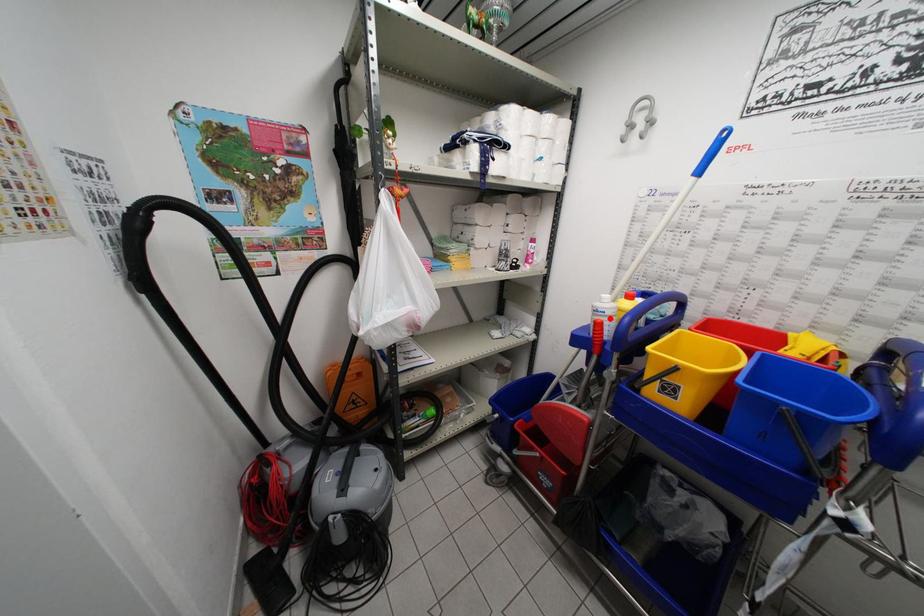
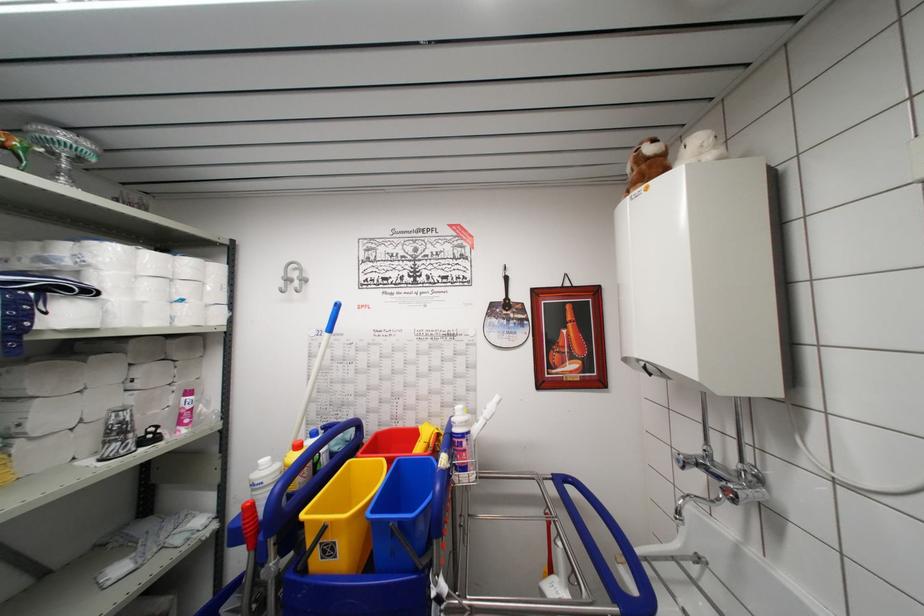
Question: I am providing you with two images of the same scene from different viewpoints. Given a red point in image1, look at the same physical point in image2. Is it:

Choices:
 (A) Closer to the viewpoint
 (B) Farther from the viewpoint

Answer: (B)